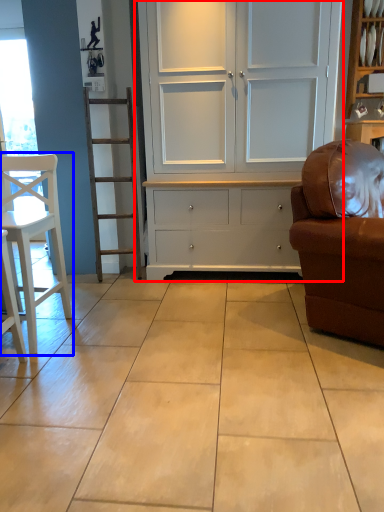
Question: Which of the following is the farthest to the observer, cupboard (highlighted by a red box) or chair (highlighted by a blue box)?

Choices:
 (A) cupboard
 (B) chair

Answer: (A)